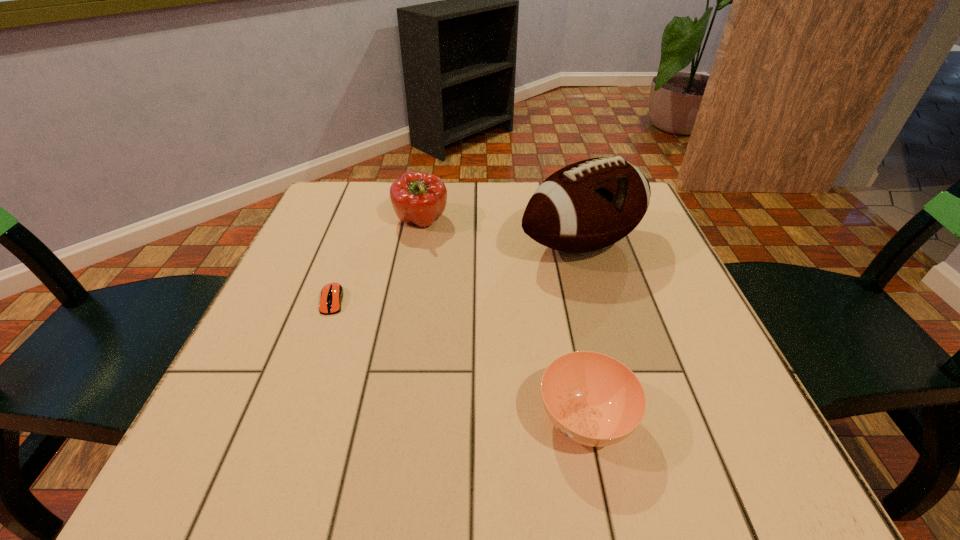
You are a GUI agent. You are given a task and a screenshot of the screen. Output one action in this format:
    pyautogui.click(x=<x>, y=<y>)
    Task: Click on the vacant space located on the back of the shortest object
    This screenshot has height=540, width=960.
    Given the screenshot: What is the action you would take?
    pyautogui.click(x=372, y=194)

The width and height of the screenshot is (960, 540). In order to click on football (American) located in the far edge section of the desktop in this screenshot , I will do `click(591, 204)`.

Identify the location of pepper located at the far edge. This screenshot has height=540, width=960. (417, 197).

Locate an element on the screen. object that is at the near edge is located at coordinates (593, 399).

I want to click on object located at the left edge, so click(x=331, y=296).

The height and width of the screenshot is (540, 960). I want to click on object situated at the right edge, so click(x=591, y=204).

Where is `object that is positioned at the far right corner`? object that is positioned at the far right corner is located at coordinates (591, 204).

The width and height of the screenshot is (960, 540). In order to click on blank space at the far edge of the desktop in this screenshot , I will do `click(386, 200)`.

The image size is (960, 540). Find the location of `vacant space at the near edge of the desktop`. vacant space at the near edge of the desktop is located at coordinates (439, 442).

At what (x,y) coordinates should I click in order to perform the action: click on free space at the left edge of the desktop. Please return your answer as a coordinate pair (x, y). The height and width of the screenshot is (540, 960). Looking at the image, I should click on pyautogui.click(x=301, y=245).